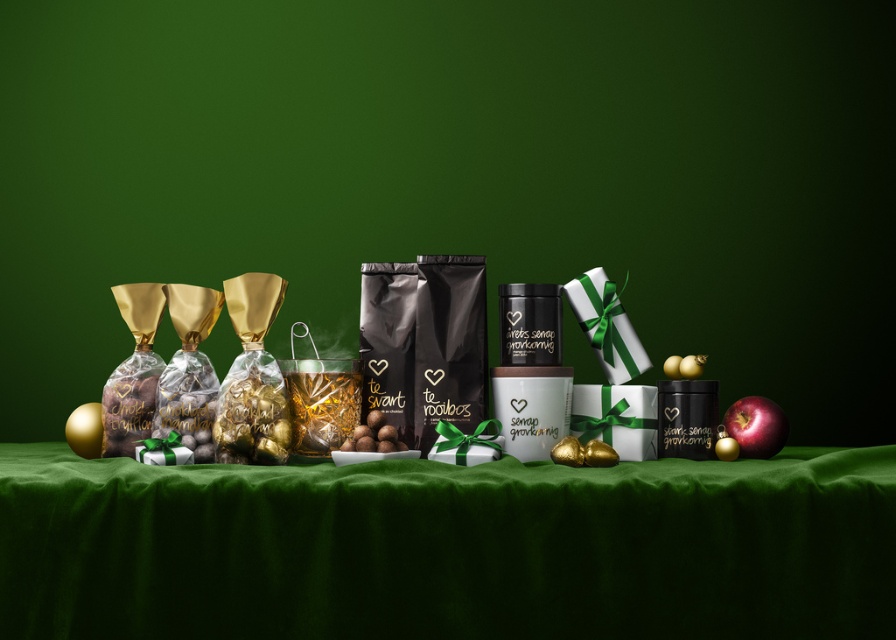
Question: Considering the real-world distances, which object is farthest from the green matte backdrop at center?

Choices:
 (A) green velvet tablecloth at center
 (B) red glossy apple at right

Answer: (B)

Question: Which of the following is the closest to the observer?

Choices:
 (A) green matte backdrop at center
 (B) green velvet tablecloth at center
 (C) red glossy apple at right

Answer: (B)

Question: Can you confirm if green matte backdrop at center is positioned to the right of red glossy apple at right?

Choices:
 (A) no
 (B) yes

Answer: (A)

Question: Among these objects, which one is nearest to the camera?

Choices:
 (A) red glossy apple at right
 (B) green matte backdrop at center

Answer: (B)

Question: Does green matte backdrop at center appear over green velvet tablecloth at center?

Choices:
 (A) no
 (B) yes

Answer: (B)

Question: Can you confirm if green matte backdrop at center is bigger than red glossy apple at right?

Choices:
 (A) yes
 (B) no

Answer: (A)